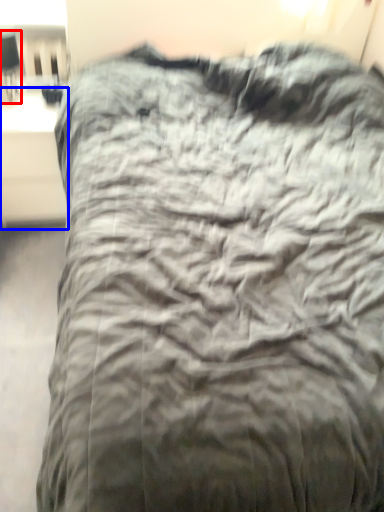
Question: Which point is further to the camera, table lamp (highlighted by a red box) or table (highlighted by a blue box)?

Choices:
 (A) table lamp
 (B) table

Answer: (B)